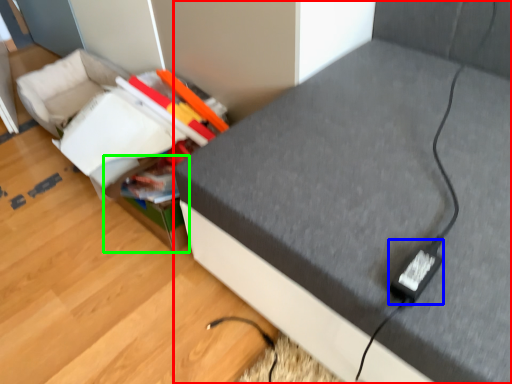
Question: Which object is the closest to the furniture (highlighted by a red box)? Choose among these: plug (highlighted by a blue box) or storage box (highlighted by a green box).

Choices:
 (A) plug
 (B) storage box

Answer: (A)